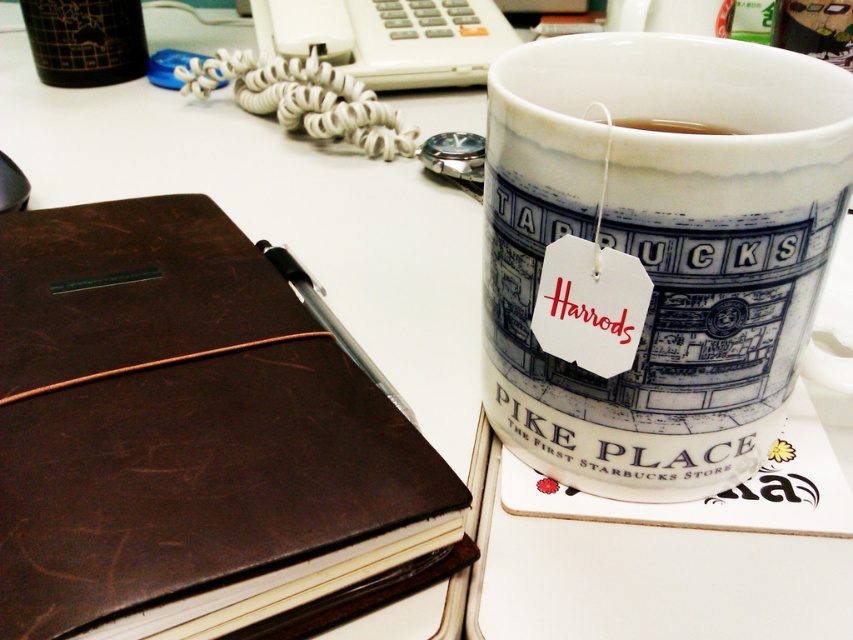
Question: Can you confirm if brown leather notebook at left is positioned above white ceramic mug at upper right?

Choices:
 (A) no
 (B) yes

Answer: (A)

Question: Among these objects, which one is nearest to the camera?

Choices:
 (A) white ceramic mug at upper right
 (B) brown leather notebook at left

Answer: (B)

Question: Which point is farther to the camera?

Choices:
 (A) (701, 253)
 (B) (631, 122)
 (C) (178, 364)

Answer: (B)

Question: Observing the image, what is the correct spatial positioning of brown leather notebook at left in reference to white ceramic mug at upper right?

Choices:
 (A) below
 (B) above

Answer: (A)

Question: Can you confirm if white ceramic mug at upper right is positioned to the right of white paper tea bag at upper center?

Choices:
 (A) yes
 (B) no

Answer: (B)

Question: Which of the following is the closest to the observer?

Choices:
 (A) (648, 122)
 (B) (410, 460)

Answer: (B)